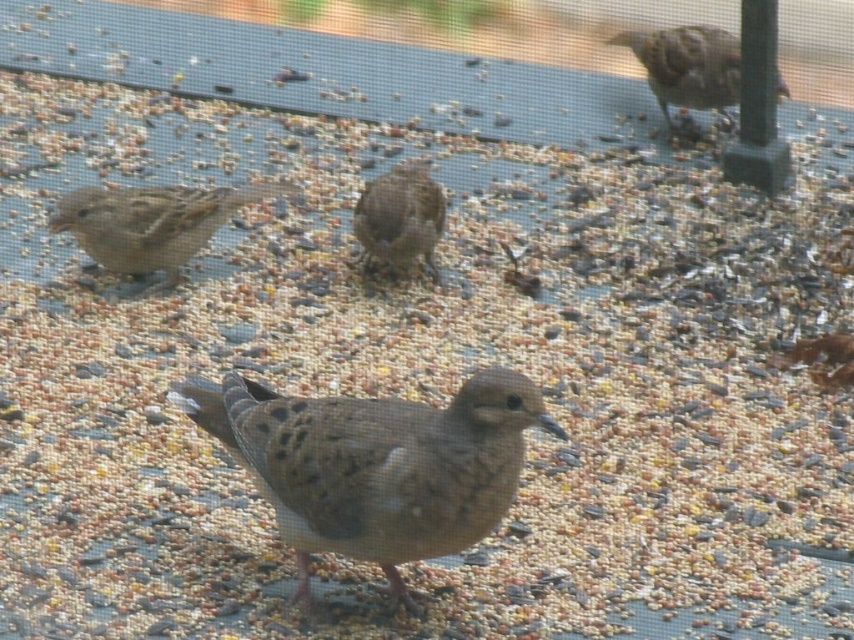
You are a birdwatcher observing the scene. You notice two birds in the image. The first is the brown speckled sparrow at upper right, and the second is the brown speckled pigeon at center. Which of these two birds is shorter in height?

The brown speckled sparrow at upper right is shorter than the brown speckled pigeon at center.